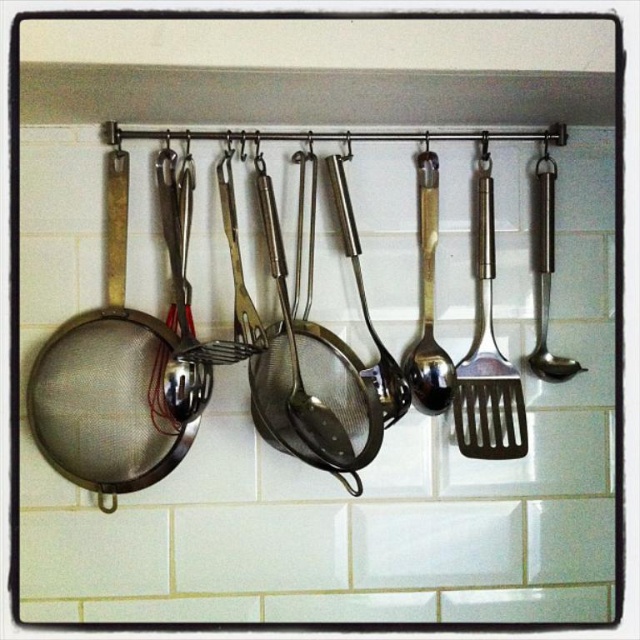
Who is positioned more to the left, satin silver mesh strainer at center or satin silver spoon at center?

From the viewer's perspective, satin silver mesh strainer at center appears more on the left side.

Consider the image. Does satin silver mesh strainer at center have a lesser width compared to satin silver spoon at center?

Incorrect, satin silver mesh strainer at center's width is not less than satin silver spoon at center's.

The width and height of the screenshot is (640, 640). Find the location of `satin silver mesh strainer at center`. satin silver mesh strainer at center is located at coordinates tap(296, 348).

Can you confirm if satin silver spatula at center is shorter than satin silver spoon at center?

No, satin silver spatula at center is not shorter than satin silver spoon at center.

Is satin silver spatula at center thinner than satin silver spoon at center?

No, satin silver spatula at center is not thinner than satin silver spoon at center.

Who is more forward, (481, 236) or (540, 224)?

Point (481, 236) is in front.

The height and width of the screenshot is (640, 640). What are the coordinates of `satin silver spatula at center` in the screenshot? It's located at (486, 353).

Is the position of satin silver spatula at center more distant than that of satin silver strainer at center?

Yes, satin silver spatula at center is behind satin silver strainer at center.

Who is more forward, (506, 433) or (390, 355)?

Point (506, 433) is more forward.

Image resolution: width=640 pixels, height=640 pixels. Find the location of `satin silver spatula at center`. satin silver spatula at center is located at coordinates (486, 353).